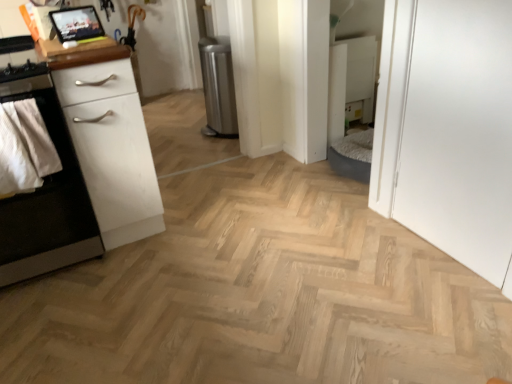
The height and width of the screenshot is (384, 512). What do you see at coordinates (260, 294) in the screenshot? I see `natural wood floor at center` at bounding box center [260, 294].

You are a GUI agent. You are given a task and a screenshot of the screen. Output one action in this format:
    pyautogui.click(x=<x>, y=<y>)
    Task: Click on the white matte cabinet at left
    Image resolution: width=512 pixels, height=384 pixels.
    Given the screenshot: What is the action you would take?
    pyautogui.click(x=47, y=200)

What are the coordinates of `metallic trash can at center, placed as the first appliance when sorted from back to front` in the screenshot? It's located at (218, 86).

Locate an element on the screen. This screenshot has height=384, width=512. white matte chest of drawers at left is located at coordinates (112, 150).

Describe the element at coordinates (112, 150) in the screenshot. I see `white matte chest of drawers at left` at that location.

Locate an element on the screen. The width and height of the screenshot is (512, 384). white cotton towel at left is located at coordinates (24, 148).

Identify the location of matte black tablet at upper left, which ranks as the 1th appliance in front-to-back order. The image size is (512, 384). (76, 24).

Describe the element at coordinates (80, 53) in the screenshot. I see `matte wood tablet at upper left` at that location.

Where is `natural wood floor at center`? natural wood floor at center is located at coordinates (260, 294).

How many degrees apart are the facing directions of white matte cabinet at left and white matte chest of drawers at left?

white matte cabinet at left and white matte chest of drawers at left are facing 3.84e-05 degrees away from each other.

Can you confirm if white matte cabinet at left is thinner than white matte chest of drawers at left?

In fact, white matte cabinet at left might be wider than white matte chest of drawers at left.

Is white matte cabinet at left aimed at white matte chest of drawers at left?

No.

Can you confirm if white matte cabinet at left is positioned to the left of white matte chest of drawers at left?

Correct, you'll find white matte cabinet at left to the left of white matte chest of drawers at left.

From the image's perspective, is metallic trash can at center, marked as the second appliance in a left-to-right arrangement, under white cotton towel at left?

Actually, metallic trash can at center, marked as the second appliance in a left-to-right arrangement, appears above white cotton towel at left in the image.

Can you confirm if metallic trash can at center, the first appliance viewed from the right, is bigger than white cotton towel at left?

Yes, metallic trash can at center, the first appliance viewed from the right, is bigger than white cotton towel at left.

Based on the photo, from a real-world perspective, does metallic trash can at center, the second appliance in the front-to-back sequence, sit lower than white cotton towel at left?

Correct, in the physical world, metallic trash can at center, the second appliance in the front-to-back sequence, is lower than white cotton towel at left.

Find the location of a particular element. The height and width of the screenshot is (384, 512). appliance beneath the white cotton towel at left (from a real-world perspective) is located at coordinates (218, 86).

Looking at the image, does white matte chest of drawers at left seem bigger or smaller compared to matte black tablet at upper left, arranged as the 2th appliance when viewed from the back?

In the image, white matte chest of drawers at left appears to be larger than matte black tablet at upper left, arranged as the 2th appliance when viewed from the back.

Is white matte chest of drawers at left at the left side of matte black tablet at upper left, which is counted as the 2th appliance, starting from the right?

Incorrect, white matte chest of drawers at left is not on the left side of matte black tablet at upper left, which is counted as the 2th appliance, starting from the right.

What's the angular difference between white matte chest of drawers at left and matte black tablet at upper left, which is counted as the 2th appliance, starting from the right,'s facing directions?

white matte chest of drawers at left and matte black tablet at upper left, which is counted as the 2th appliance, starting from the right, are facing 12 degrees away from each other.

Which is closer to the camera, (103, 187) or (84, 8)?

Point (84, 8)

Does white cotton towel at left lie in front of natural wood floor at center?

No, white cotton towel at left is further to the viewer.

Does white cotton towel at left have a smaller size compared to natural wood floor at center?

Correct, white cotton towel at left occupies less space than natural wood floor at center.

I want to click on material below the matte black tablet at upper left, arranged as the 2th appliance when viewed from the back (from a real-world perspective), so click(x=24, y=148).

Is matte black tablet at upper left, the 1th appliance positioned from the left, facing towards white cotton towel at left?

No, matte black tablet at upper left, the 1th appliance positioned from the left, is not oriented towards white cotton towel at left.

Choose the correct answer: Is matte black tablet at upper left, which ranks as the 1th appliance in front-to-back order, inside white cotton towel at left or outside it?

matte black tablet at upper left, which ranks as the 1th appliance in front-to-back order, cannot be found inside white cotton towel at left.

Can you confirm if matte wood tablet at upper left is wider than white matte chest of drawers at left?

No, matte wood tablet at upper left is not wider than white matte chest of drawers at left.

From a real-world perspective, between matte wood tablet at upper left and white matte chest of drawers at left, who is vertically higher?

From a 3D spatial view, matte wood tablet at upper left is above.

At what (x,y) coordinates should I click in order to perform the action: click on chest of drawers in front of the matte wood tablet at upper left. Please return your answer as a coordinate pair (x, y). Looking at the image, I should click on (112, 150).

Considering the positions of objects white matte cabinet at left and white cotton towel at left in the image provided, who is more to the right, white matte cabinet at left or white cotton towel at left?

white cotton towel at left.

How much distance is there between white matte cabinet at left and white cotton towel at left?

They are 7.22 inches apart.

Is white matte cabinet at left turned away from white cotton towel at left?

No, white matte cabinet at left's orientation is not away from white cotton towel at left.

Considering the sizes of objects white matte cabinet at left and white cotton towel at left in the image provided, who is taller, white matte cabinet at left or white cotton towel at left?

With more height is white matte cabinet at left.

Where is `chest of drawers on the right of white matte cabinet at left`? The height and width of the screenshot is (384, 512). chest of drawers on the right of white matte cabinet at left is located at coordinates (112, 150).

The height and width of the screenshot is (384, 512). What are the coordinates of `material in front of the metallic trash can at center, placed as the first appliance when sorted from back to front` in the screenshot? It's located at (24, 148).

Considering their positions, is natural wood floor at center positioned further to metallic trash can at center, the first appliance viewed from the right, than white matte chest of drawers at left?

natural wood floor at center lies further to metallic trash can at center, the first appliance viewed from the right, than the other object.

Estimate the real-world distances between objects in this image. Which object is closer to white cotton towel at left, white matte cabinet at left or matte black tablet at upper left, the 1th appliance positioned from the left?

Among the two, white matte cabinet at left is located nearer to white cotton towel at left.

From the image, which object appears to be farther from white cotton towel at left, matte black tablet at upper left, the 1th appliance positioned from the left, or white matte cabinet at left?

A: matte black tablet at upper left, the 1th appliance positioned from the left, is positioned further to the anchor white cotton towel at left.

Which object lies further to the anchor point matte black tablet at upper left, which is counted as the 2th appliance, starting from the right, white matte cabinet at left or metallic trash can at center, the first appliance viewed from the right?

Among the two, metallic trash can at center, the first appliance viewed from the right, is located further to matte black tablet at upper left, which is counted as the 2th appliance, starting from the right.

Consider the image. Considering their positions, is white cotton towel at left positioned closer to natural wood floor at center than white matte chest of drawers at left?

Among the two, white matte chest of drawers at left is located nearer to natural wood floor at center.

Considering their positions, is natural wood floor at center positioned further to metallic trash can at center, the first appliance viewed from the right, than white cotton towel at left?

The object further to metallic trash can at center, the first appliance viewed from the right, is white cotton towel at left.

Based on the photo, based on their spatial positions, is white matte cabinet at left or matte wood tablet at upper left further from matte black tablet at upper left, the 1th appliance positioned from the left?

white matte cabinet at left lies further to matte black tablet at upper left, the 1th appliance positioned from the left, than the other object.

From the image, which object appears to be farther from white matte chest of drawers at left, matte black tablet at upper left, which is counted as the 2th appliance, starting from the right, or white cotton towel at left?

matte black tablet at upper left, which is counted as the 2th appliance, starting from the right, is further to white matte chest of drawers at left.

At what (x,y) coordinates should I click in order to perform the action: click on the chest of drawers located between white cotton towel at left and natural wood floor at center in the left-right direction. Please return your answer as a coordinate pair (x, y). Looking at the image, I should click on (112, 150).

I want to click on material between white matte cabinet at left and white matte chest of drawers at left, so click(x=24, y=148).

Where is `chest of drawers between natural wood floor at center and metallic trash can at center, the second appliance in the front-to-back sequence, from front to back`? The width and height of the screenshot is (512, 384). chest of drawers between natural wood floor at center and metallic trash can at center, the second appliance in the front-to-back sequence, from front to back is located at coordinates (112, 150).

This screenshot has height=384, width=512. What are the coordinates of `counter top located between white matte cabinet at left and metallic trash can at center, the first appliance viewed from the right, in the depth direction` in the screenshot? It's located at tap(80, 53).